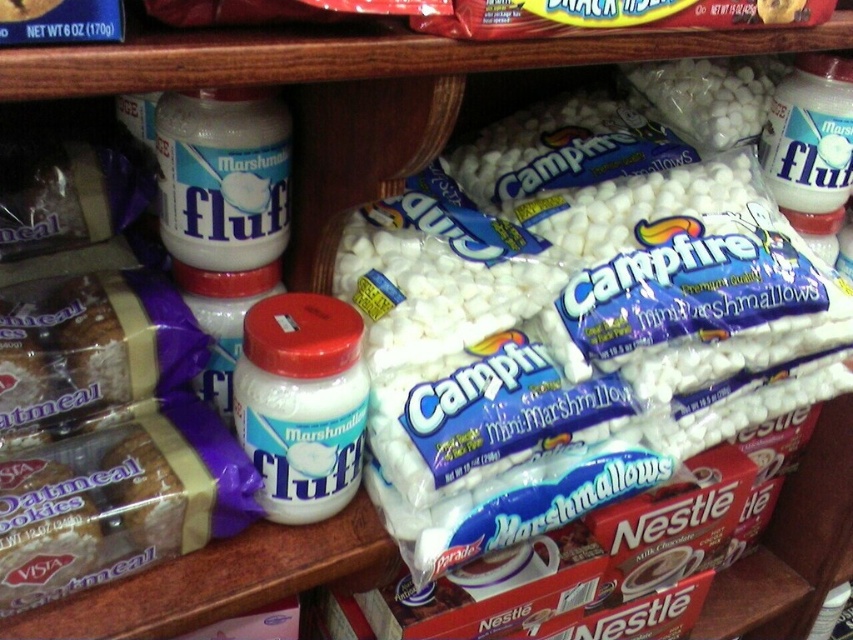
Question: Is white matte jar at center-left wider than matte white marshmallow fluff at left?

Choices:
 (A) no
 (B) yes

Answer: (A)

Question: Considering the relative positions of white matte jar at center-left and matte white marshmallow fluff at left in the image provided, where is white matte jar at center-left located with respect to matte white marshmallow fluff at left?

Choices:
 (A) right
 (B) left

Answer: (A)

Question: Which object is farther from the camera taking this photo?

Choices:
 (A) white matte jar at center-left
 (B) matte white marshmallow fluff at left

Answer: (B)

Question: Which point is farther to the camera?

Choices:
 (A) (212, 196)
 (B) (279, 470)

Answer: (A)

Question: Can you confirm if white matte jar at center-left is positioned below matte white marshmallow fluff at left?

Choices:
 (A) no
 (B) yes

Answer: (B)